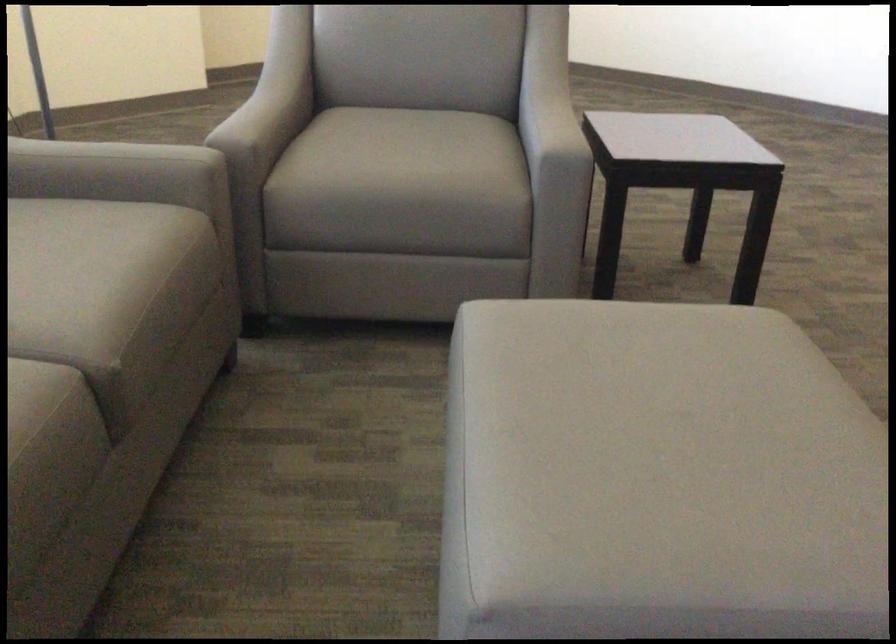
Find the location of a particular element. This screenshot has height=644, width=896. chair sitting surface is located at coordinates (400, 185).